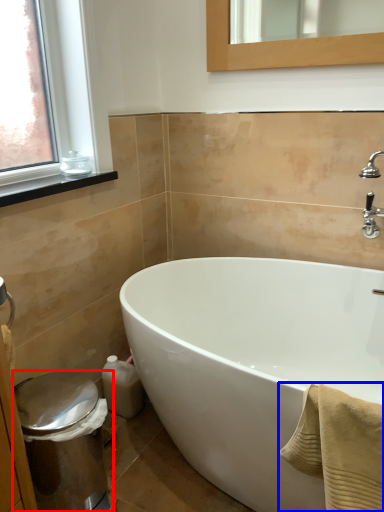
Question: Which object is further to the camera taking this photo, bidet (highlighted by a red box) or bath towel (highlighted by a blue box)?

Choices:
 (A) bidet
 (B) bath towel

Answer: (A)